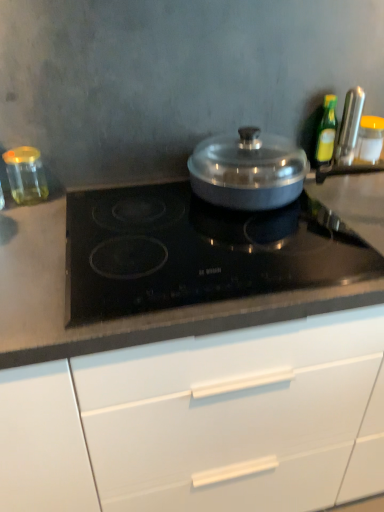
The width and height of the screenshot is (384, 512). In order to click on free space in front of transparent glass jar at left, the first kitchen appliance in the left-to-right sequence in this screenshot , I will do `click(28, 228)`.